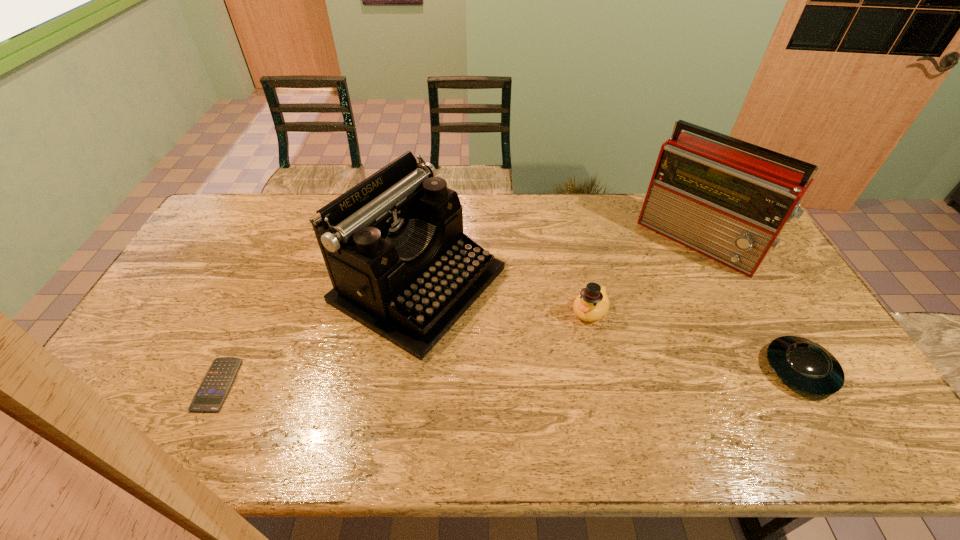
Find the location of a particular element. The image size is (960, 540). calculator is located at coordinates (218, 380).

Identify the location of the shortest object. This screenshot has height=540, width=960. (218, 380).

Locate an element on the screen. This screenshot has width=960, height=540. saucer is located at coordinates (803, 364).

Locate an element on the screen. This screenshot has height=540, width=960. radio receiver is located at coordinates (730, 206).

The height and width of the screenshot is (540, 960). Find the location of `the third object from left to right`. the third object from left to right is located at coordinates 592,303.

The image size is (960, 540). Find the location of `the third tallest object`. the third tallest object is located at coordinates (592, 303).

This screenshot has height=540, width=960. What are the coordinates of `the fourth object from right to left` in the screenshot? It's located at (393, 245).

I want to click on free space located 0.200m on the back of the calculator, so click(256, 302).

You are a GUI agent. You are given a task and a screenshot of the screen. Output one action in this format:
    pyautogui.click(x=<x>, y=<y>)
    Task: Click on the vacant space situated 0.050m on the back of the fourth tallest object
    The height and width of the screenshot is (540, 960).
    Given the screenshot: What is the action you would take?
    pyautogui.click(x=775, y=327)

At what (x,y) coordinates should I click in order to perform the action: click on vacant region located on the front-facing side of the radio receiver. Please return your answer as a coordinate pair (x, y). Looking at the image, I should click on (618, 329).